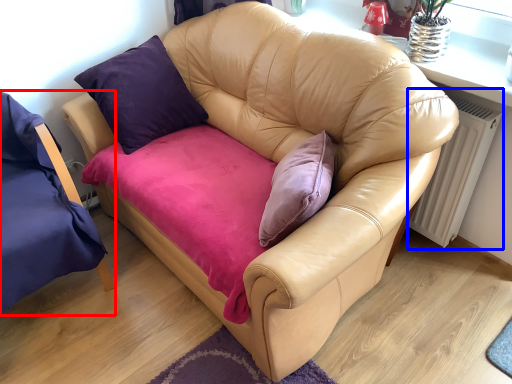
Question: Which point is further to the camera, chair (highlighted by a red box) or radiator (highlighted by a blue box)?

Choices:
 (A) chair
 (B) radiator

Answer: (B)